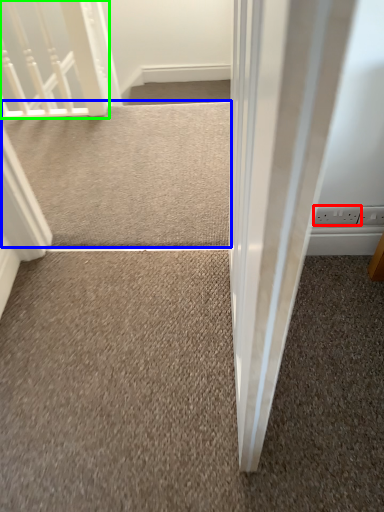
Question: Which object is the closest to the electric outlet (highlighted by a red box)? Choose among these: doormat (highlighted by a blue box) or rail (highlighted by a green box).

Choices:
 (A) doormat
 (B) rail

Answer: (A)